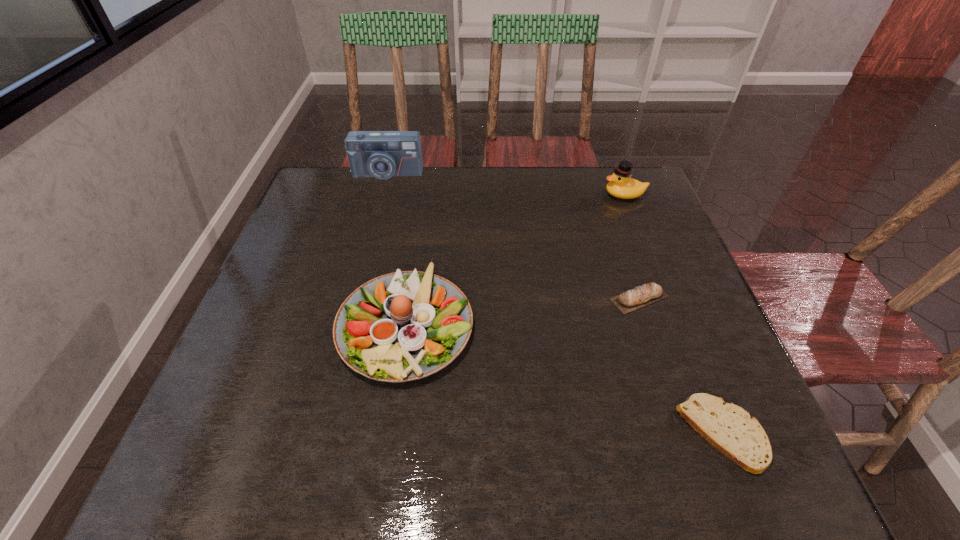
The image size is (960, 540). I want to click on object that is at the far left corner, so click(x=381, y=154).

This screenshot has width=960, height=540. In order to click on object present at the far right corner in this screenshot , I will do point(621,185).

Image resolution: width=960 pixels, height=540 pixels. In order to click on object present at the near right corner in this screenshot , I will do `click(729, 428)`.

In the image, there is a desktop. Identify the location of vacant area at the far edge. (485, 181).

In the image, there is a desktop. At what (x,y) coordinates should I click in order to perform the action: click on vacant region at the left edge. Please return your answer as a coordinate pair (x, y). Image resolution: width=960 pixels, height=540 pixels. Looking at the image, I should click on (251, 381).

Find the location of a particular element. The width and height of the screenshot is (960, 540). blank space at the right edge is located at coordinates (637, 279).

Locate an element on the screen. This screenshot has width=960, height=540. free region at the far left corner of the desktop is located at coordinates (339, 184).

Identify the location of free location at the far right corner of the desktop. (611, 211).

Locate an element on the screen. The width and height of the screenshot is (960, 540). free spot at the near right corner of the desktop is located at coordinates (706, 441).

This screenshot has height=540, width=960. In order to click on blank region between the fourth tallest object and the second farthest object in this screenshot , I will do `click(632, 246)`.